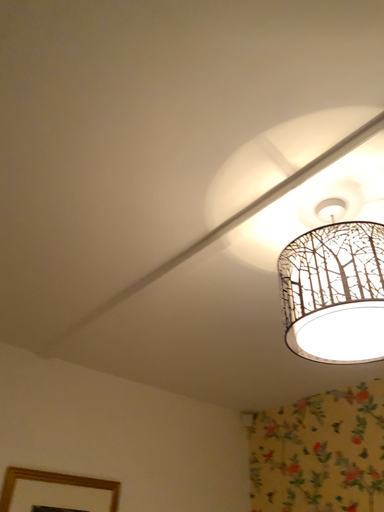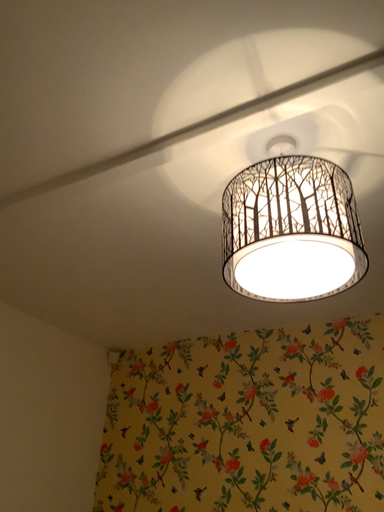
Question: Which way did the camera rotate in the video?

Choices:
 (A) rotated downward
 (B) rotated upward

Answer: (A)